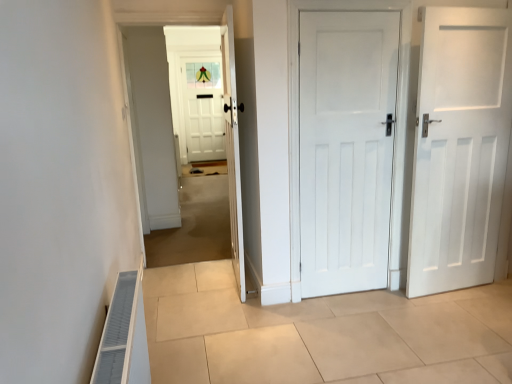
Question: In which direction should I rotate to look at white painted wood door at center, positioned as the second door in left-to-right order?

Choices:
 (A) left
 (B) right

Answer: (B)

Question: Considering the relative sizes of white matte door at right, arranged as the first door when viewed from the right, and white wooden door at center in the image provided, is white matte door at right, arranged as the first door when viewed from the right, shorter than white wooden door at center?

Choices:
 (A) no
 (B) yes

Answer: (B)

Question: Is white matte door at right, arranged as the first door when viewed from the right, behind white wooden door at center?

Choices:
 (A) no
 (B) yes

Answer: (A)

Question: Is white matte door at right, arranged as the first door when viewed from the right, thinner than white wooden door at center?

Choices:
 (A) no
 (B) yes

Answer: (B)

Question: Does white matte door at right, arranged as the first door when viewed from the right, appear on the left side of white wooden door at center?

Choices:
 (A) yes
 (B) no

Answer: (B)

Question: Can you see white matte door at right, arranged as the first door when viewed from the right, touching white wooden door at center?

Choices:
 (A) no
 (B) yes

Answer: (A)

Question: Does white matte door at right, arranged as the first door when viewed from the right, turn towards white wooden door at center?

Choices:
 (A) yes
 (B) no

Answer: (B)

Question: From a real-world perspective, is white wooden door at center below beige tile floor at center?

Choices:
 (A) no
 (B) yes

Answer: (A)

Question: Can you confirm if white wooden door at center is smaller than beige tile floor at center?

Choices:
 (A) yes
 (B) no

Answer: (A)

Question: Does white wooden door at center have a greater height compared to beige tile floor at center?

Choices:
 (A) yes
 (B) no

Answer: (A)

Question: From a real-world perspective, is white wooden door at center on beige tile floor at center?

Choices:
 (A) yes
 (B) no

Answer: (A)

Question: Does white wooden door at center have a greater width compared to beige tile floor at center?

Choices:
 (A) no
 (B) yes

Answer: (A)

Question: Does white wooden door at center have a larger size compared to beige tile floor at center?

Choices:
 (A) yes
 (B) no

Answer: (B)

Question: Is white wooden door at center, placed as the first door when sorted from left to right, not inside white painted wood door at center, the second door when ordered from right to left?

Choices:
 (A) yes
 (B) no

Answer: (A)